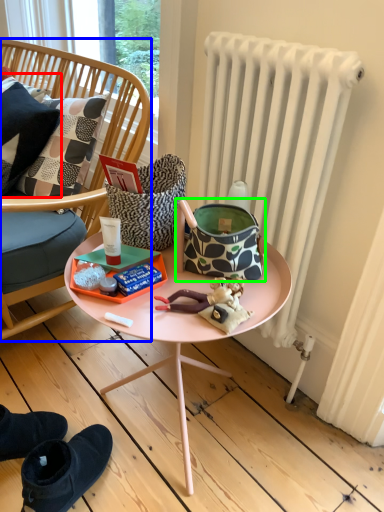
Question: Estimate the real-world distances between objects in this image. Which object is farther from pillow (highlighted by a red box), chair (highlighted by a blue box) or handbag (highlighted by a green box)?

Choices:
 (A) chair
 (B) handbag

Answer: (B)